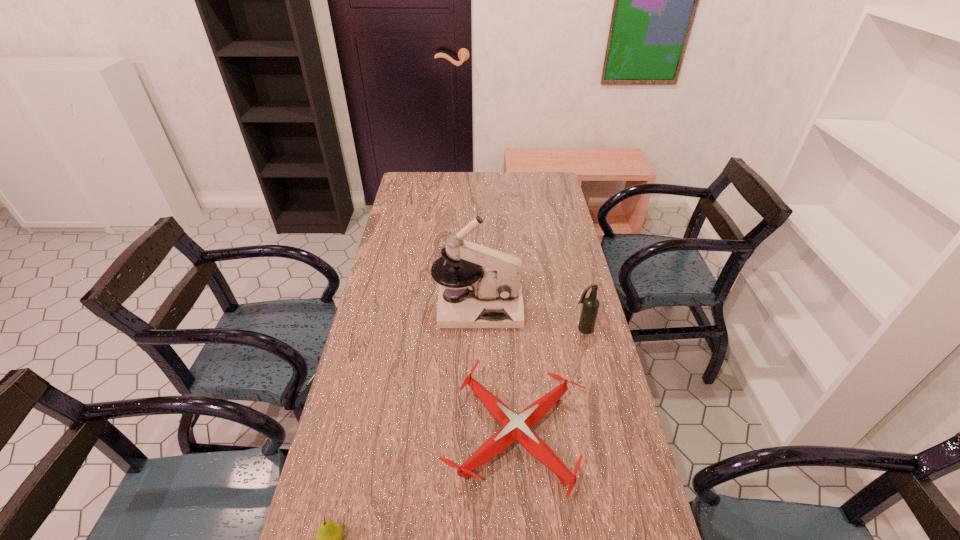
Find the location of a particular element. This screenshot has height=540, width=960. microscope is located at coordinates (492, 296).

Locate an element on the screen. the rightmost object is located at coordinates (590, 307).

Locate an element on the screen. the third shortest object is located at coordinates (590, 307).

Identify the location of the shortest object. (515, 427).

The image size is (960, 540). In order to click on drone in this screenshot , I will do (x=515, y=427).

Image resolution: width=960 pixels, height=540 pixels. I want to click on vacant space situated at the eyepiece of the tallest object, so click(x=582, y=307).

Locate an element on the screen. Image resolution: width=960 pixels, height=540 pixels. vacant region located 0.370m on the front of the second tallest object is located at coordinates (610, 441).

Image resolution: width=960 pixels, height=540 pixels. I want to click on free spot located 0.210m on the left of the second nearest object, so click(364, 436).

Identify the location of beer bottle that is at the right edge. The image size is (960, 540). (590, 307).

This screenshot has height=540, width=960. In order to click on drone positioned at the right edge in this screenshot , I will do `click(515, 427)`.